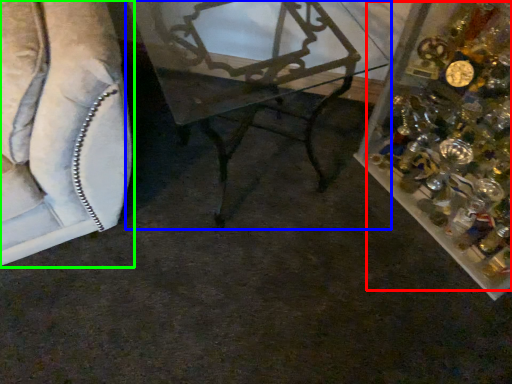
Question: Considering the real-world distances, which object is farthest from christmas decoration (highlighted by a red box)? table (highlighted by a blue box) or furniture (highlighted by a green box)?

Choices:
 (A) table
 (B) furniture

Answer: (B)